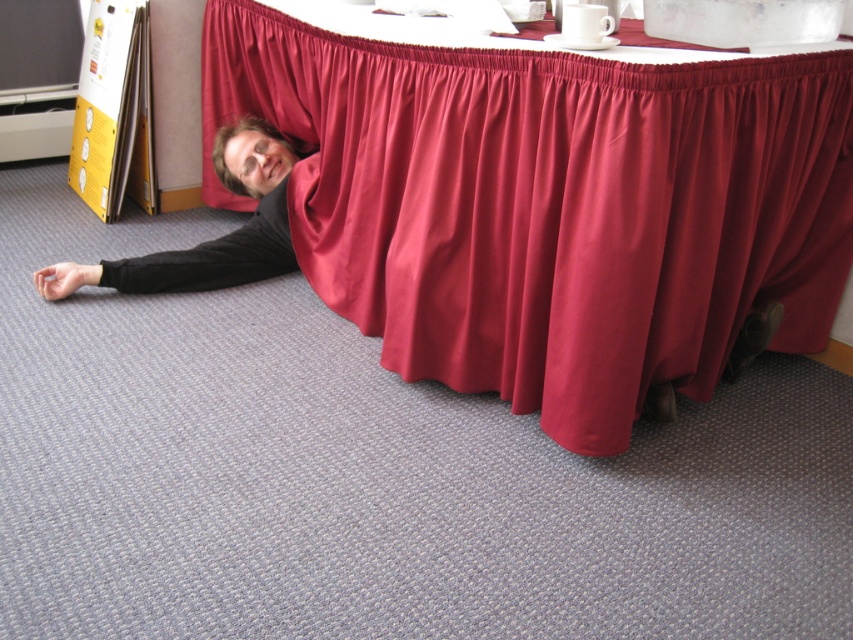
Between burgundy satin curtain at lower center and black matte shirt at lower left, which one has more height?

burgundy satin curtain at lower center

Does burgundy satin curtain at lower center appear under black matte shirt at lower left?

No.

Who is more distant from viewer, (366,285) or (264,129)?

Positioned behind is point (264,129).

Locate an element on the screen. The image size is (853, 640). burgundy satin curtain at lower center is located at coordinates (548, 205).